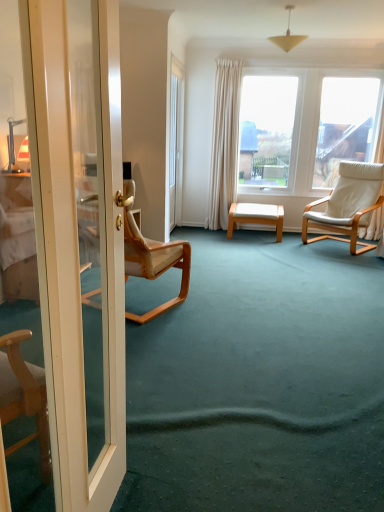
Question: Choose the correct answer: Is white glossy door at left inside transparent glass door at center or outside it?

Choices:
 (A) inside
 (B) outside

Answer: (B)

Question: Is point (64, 152) positioned closer to the camera than point (170, 135)?

Choices:
 (A) farther
 (B) closer

Answer: (B)

Question: Which of these objects is positioned closest to the transparent glass door at center?

Choices:
 (A) white glossy door at left
 (B) white leather chair at right, which is counted as the 2th chair, starting from the left
 (C) white wood stool at center
 (D) light beige wood chair at left, which ranks as the first chair in left-to-right order
 (E) matte white cone at upper center

Answer: (C)

Question: Which object is the farthest from the matte white cone at upper center?

Choices:
 (A) light beige wood chair at left, the 2th chair viewed from the back
 (B) white wood stool at center
 (C) white glossy door at left
 (D) white leather chair at right, the 2th chair in the front-to-back sequence
 (E) transparent glass door at center

Answer: (C)